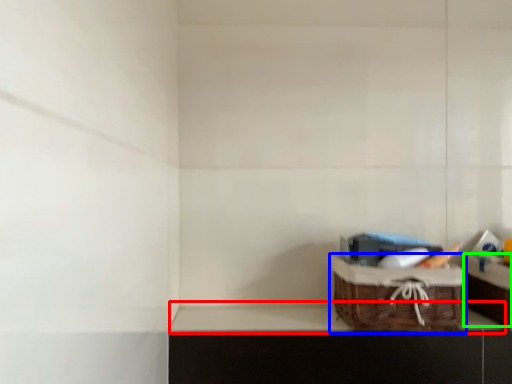
Question: Estimate the real-world distances between objects in this image. Which object is farther from window sill (highlighted by a red box), picnic basket (highlighted by a blue box) or cabinetry (highlighted by a green box)?

Choices:
 (A) picnic basket
 (B) cabinetry

Answer: (B)